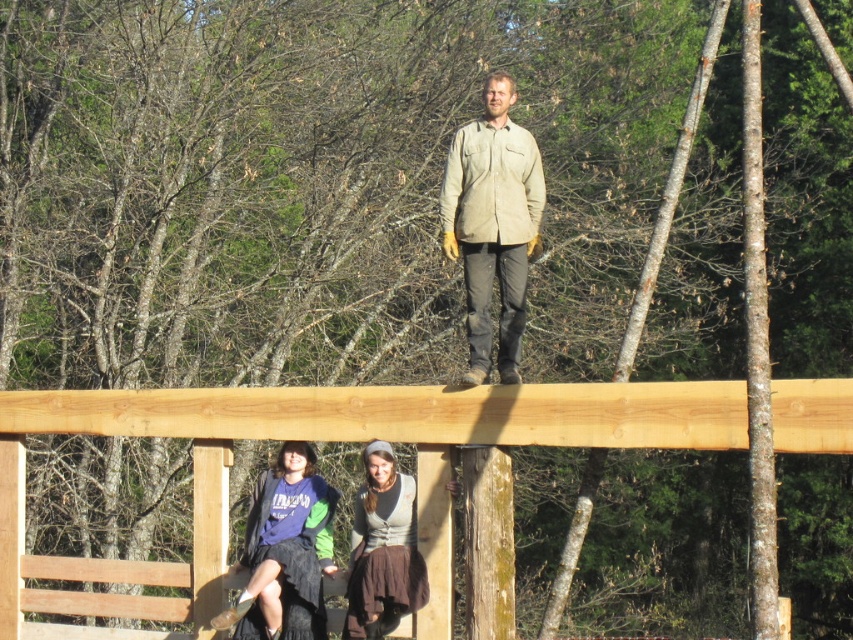
Question: Estimate the real-world distances between objects in this image. Which object is closer to the natural wood beam at upper center?

Choices:
 (A) khaki cotton shirt at center
 (B) dark blue fabric skirt at lower center

Answer: (A)

Question: Is natural wood beam at upper center below dark blue fabric skirt at lower center?

Choices:
 (A) no
 (B) yes

Answer: (A)

Question: Is dark blue fabric skirt at lower center to the left of brown fabric skirt at lower center from the viewer's perspective?

Choices:
 (A) no
 (B) yes

Answer: (B)

Question: Based on their relative distances, which object is nearer to the brown fabric skirt at lower center?

Choices:
 (A) dark blue fabric skirt at lower center
 (B) khaki cotton shirt at center
 (C) natural wood beam at upper center

Answer: (A)

Question: Does natural wood beam at upper center have a lesser width compared to khaki cotton shirt at center?

Choices:
 (A) yes
 (B) no

Answer: (A)

Question: Which object is farther from the camera taking this photo?

Choices:
 (A) natural wood beam at upper center
 (B) brown fabric skirt at lower center

Answer: (B)